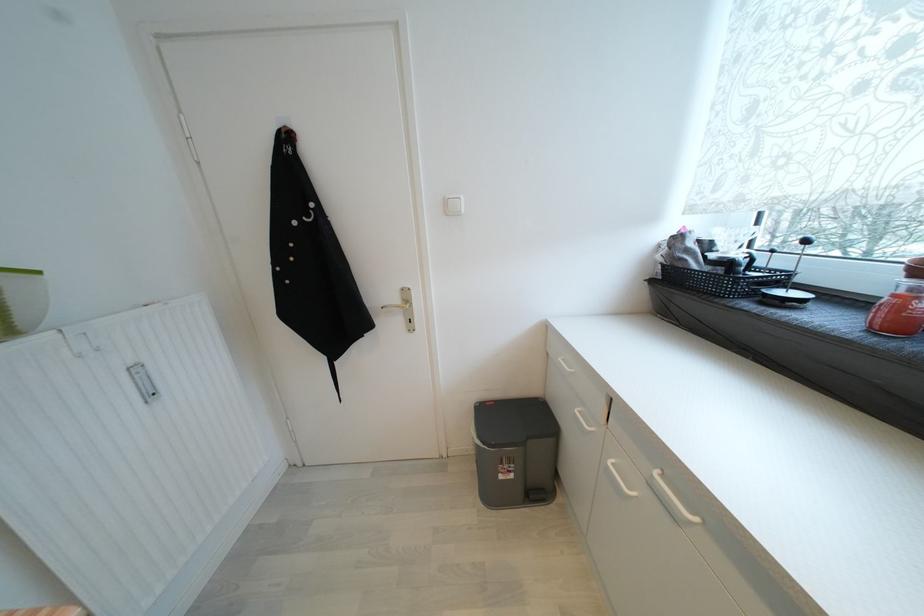
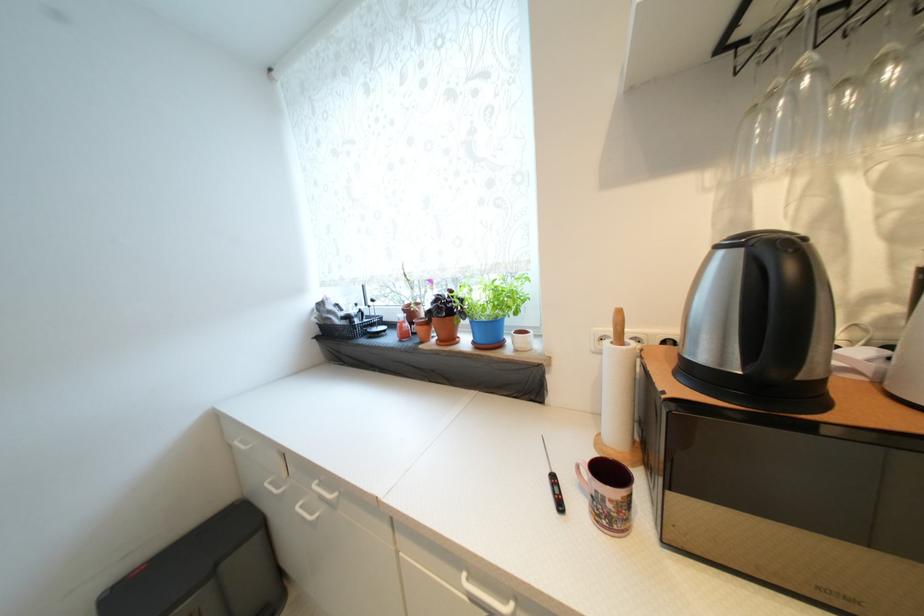
Question: The camera is either moving clockwise (left) or counter-clockwise (right) around the object. The first image is from the beginning of the video and the second image is from the end. Is the camera moving left or right when shooting the video?

Choices:
 (A) Left
 (B) Right

Answer: (A)